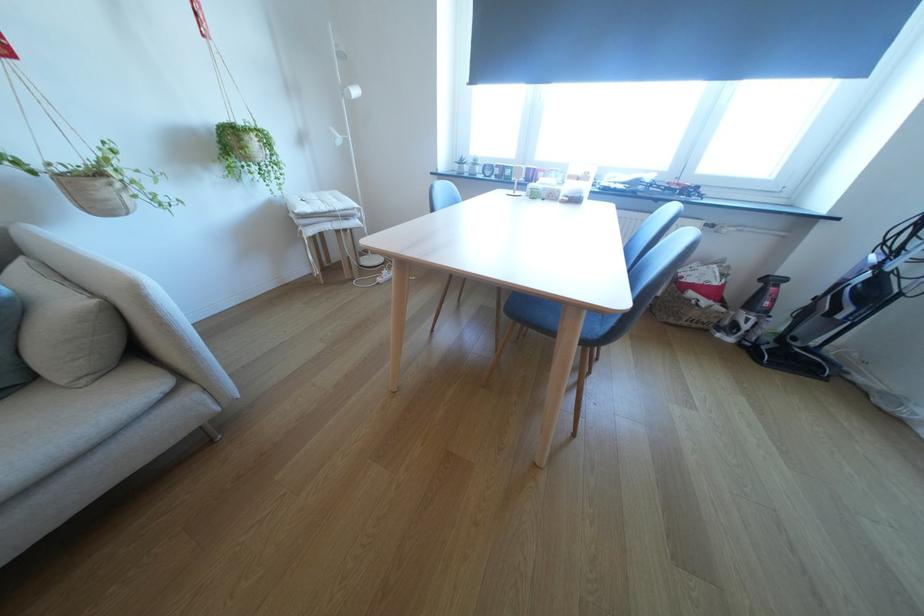
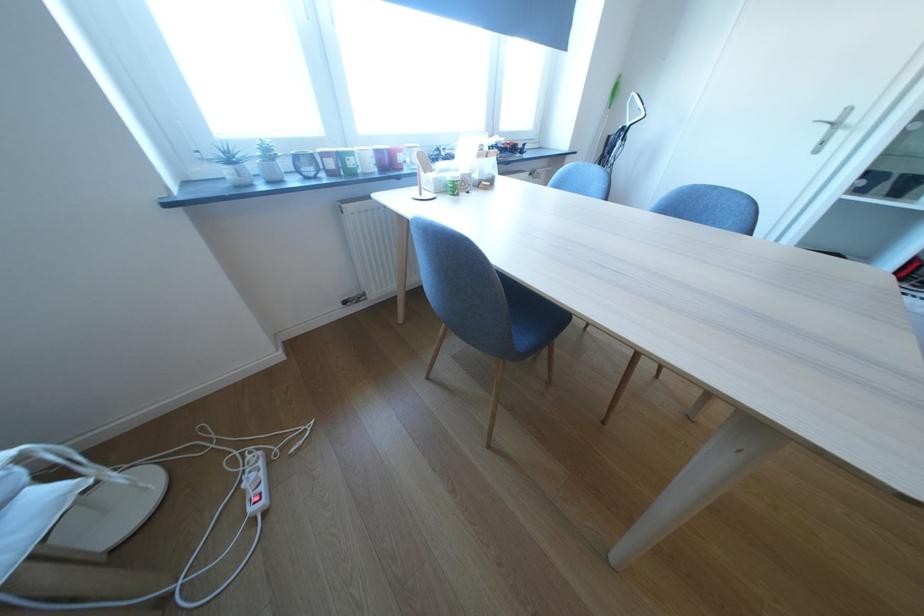
The point at (518, 174) is marked in the first image. Where is the corresponding point in the second image?

(361, 164)